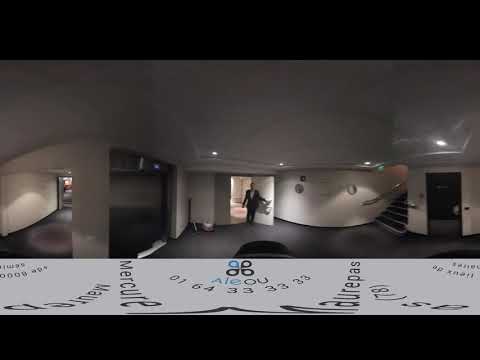
You are a GUI agent. You are given a task and a screenshot of the screen. Output one action in this format:
    pyautogui.click(x=<x>, y=<y>)
    Task: Click on the open doorway
    
    Given the screenshot: What is the action you would take?
    pyautogui.click(x=242, y=195), pyautogui.click(x=68, y=188)